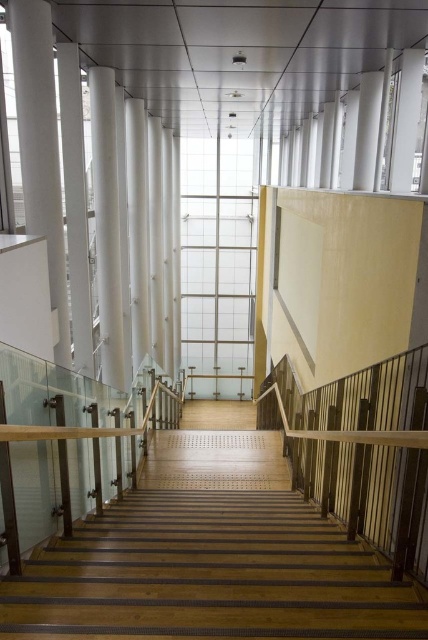
You are an interior designer planning to place a 2m wide sofa in this space. You see the wooden stairs at center and the wooden at right. Which area between them has enough space to accommodate the sofa?

The wooden stairs at center has a larger width than the wooden at right, so the area near the wooden stairs at center can accommodate the 2m wide sofa.

You are standing at the bottom of the staircase and want to reach a point that is in front of another point. Which of the two points, point (67, 317) or point (107, 289), is closer to you?

Point (67, 317) is in front of point (107, 289), so it is closer to you.

You are a painter needing to paint the wooden at right and the white glossy pillar at center. Which object should you paint first if you want to start with the one closer to the wall?

The white glossy pillar at center is closer to the wall than the wooden at right, so you should paint the white glossy pillar at center first.